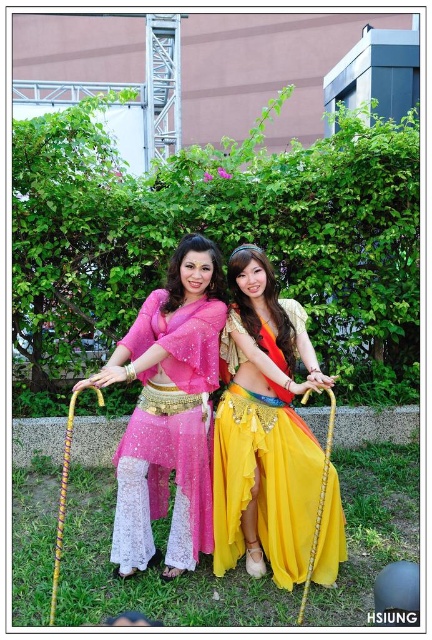
Question: From the image, what is the correct spatial relationship of shiny yellow fabric skirt at center in relation to pink lace pants at center?

Choices:
 (A) right
 (B) left

Answer: (A)

Question: Observing the image, what is the correct spatial positioning of shiny yellow fabric skirt at center in reference to pink lace pants at center?

Choices:
 (A) below
 (B) above

Answer: (A)

Question: Which point is closer to the camera?

Choices:
 (A) shiny yellow fabric skirt at center
 (B) pink lace pants at center

Answer: (A)

Question: Is shiny yellow fabric skirt at center bigger than pink lace pants at center?

Choices:
 (A) no
 (B) yes

Answer: (A)